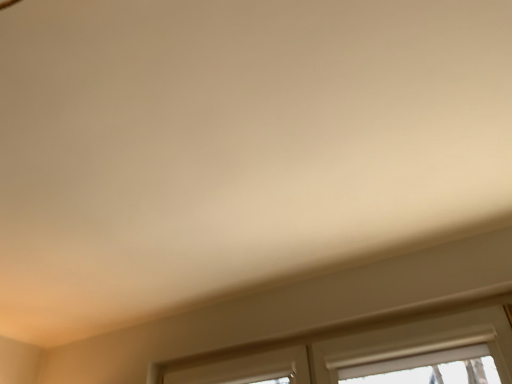
Locate an element on the screen. white painted wood window at lower center is located at coordinates (357, 350).

What do you see at coordinates (357, 350) in the screenshot?
I see `white painted wood window at lower center` at bounding box center [357, 350].

Identify the location of white painted wood window at lower center. (357, 350).